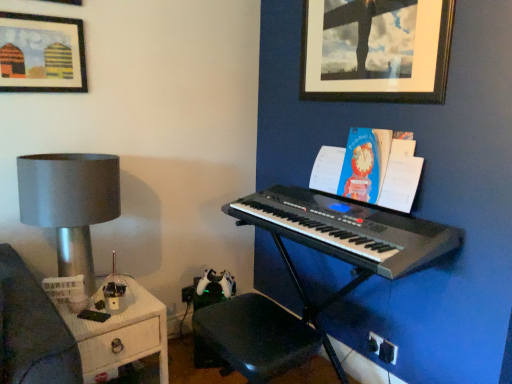
Question: From their relative heights in the image, would you say matte wood picture frame at upper left, arranged as the 2th picture frame when viewed from the right, is taller or shorter than matte silver lamp at left?

Choices:
 (A) short
 (B) tall

Answer: (A)

Question: Is matte wood picture frame at upper left, arranged as the 2th picture frame when viewed from the right, wider or thinner than matte silver lamp at left?

Choices:
 (A) thin
 (B) wide

Answer: (A)

Question: Which object is positioned closest to the black matte picture frame at upper right, the 2th picture frame positioned from the left?

Choices:
 (A) blue paper book at upper right
 (B) black plastic keyboard at center
 (C) matte silver lamp at left
 (D) black plastic music stool at lower center
 (E) matte wood picture frame at upper left, which ranks as the first picture frame in left-to-right order

Answer: (A)

Question: Considering the real-world distances, which object is closest to the black plastic keyboard at center?

Choices:
 (A) matte silver lamp at left
 (B) white wood side table at lower left
 (C) blue paper book at upper right
 (D) black plastic keyboard at center
 (E) black matte picture frame at upper right, the 2th picture frame positioned from the left

Answer: (D)